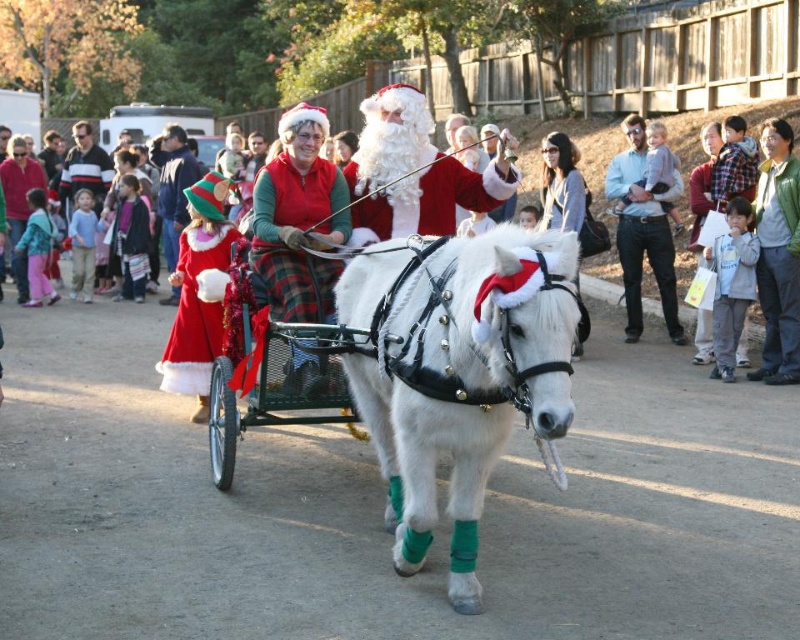
Question: Can you confirm if white fluffy beard at center is bigger than striped sweater at center?

Choices:
 (A) yes
 (B) no

Answer: (B)

Question: Does white glossy horse at center appear on the right side of white fluffy santa at center?

Choices:
 (A) no
 (B) yes

Answer: (B)

Question: Which of the following is the farthest from the observer?

Choices:
 (A) (716, 348)
 (B) (452, 563)
 (C) (276, 196)

Answer: (A)

Question: Which of the following is the farthest from the observer?

Choices:
 (A) [294, 125]
 (B) [80, 148]
 (C) [501, 266]
 (D) [426, 198]

Answer: (B)

Question: Among these points, which one is farthest from the camera?

Choices:
 (A) (362, 413)
 (B) (733, 269)
 (C) (300, 280)

Answer: (B)

Question: Can you confirm if matte red coat at upper center is smaller than gray fleece jacket at lower right?

Choices:
 (A) yes
 (B) no

Answer: (B)